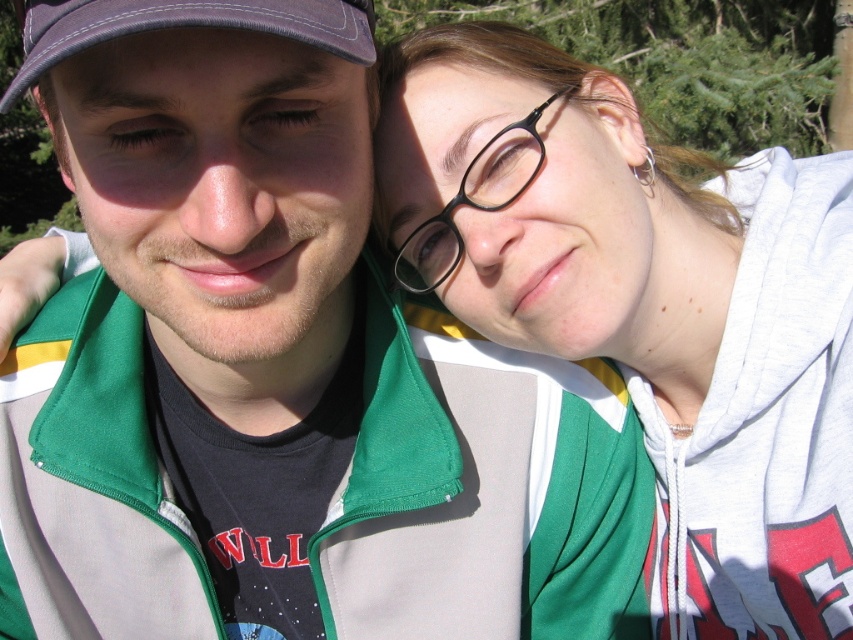
You are taking a photo of two friends in a park. You notice the purple fabric baseball cap at upper left and the black plastic glasses at upper right. Which object is positioned more to the left side of the image?

The purple fabric baseball cap at upper left is positioned more to the left side of the image than the black plastic glasses at upper right.

You are a photographer trying to capture a candid shot of the two people in the image. You want to ensure that both the matte green hoodie at upper right and the purple fabric baseball cap at upper left are clearly visible in the frame. Based on their positions, which object is closer to the center of the image?

The purple fabric baseball cap at upper left is closer to the center of the image because the matte green hoodie at upper right is positioned on the right side of it.

You are a photographer adjusting the framing of a portrait. The subjects are wearing a matte green hoodie at upper right and black plastic glasses at upper right. If your camera has a minimum focus distance of 20 centimeters, will you need to adjust your position to ensure both items are in focus?

The matte green hoodie at upper right and black plastic glasses at upper right are 23.42 centimeters apart from each other. Since the distance between them is greater than the camera minimum focus distance of 20 centimeters, you do not need to adjust your position. Both items will be in focus as they are within the camera focus range.